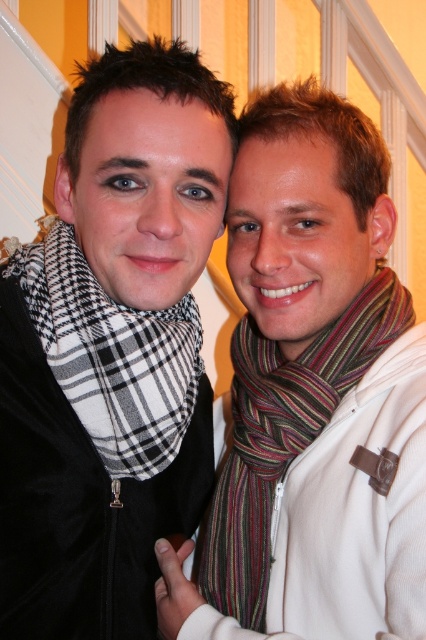
What do you see at coordinates (282, 436) in the screenshot? The height and width of the screenshot is (640, 426). I see `striped wool scarf at right` at bounding box center [282, 436].

You are a GUI agent. You are given a task and a screenshot of the screen. Output one action in this format:
    pyautogui.click(x=<x>, y=<y>)
    Task: Click on the striped wool scarf at right
    
    Given the screenshot: What is the action you would take?
    pyautogui.click(x=282, y=436)